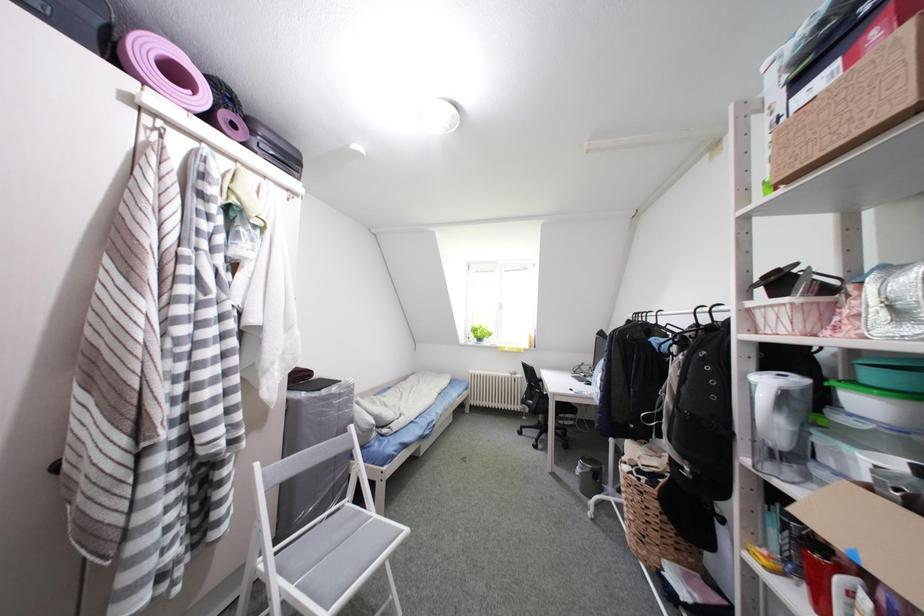
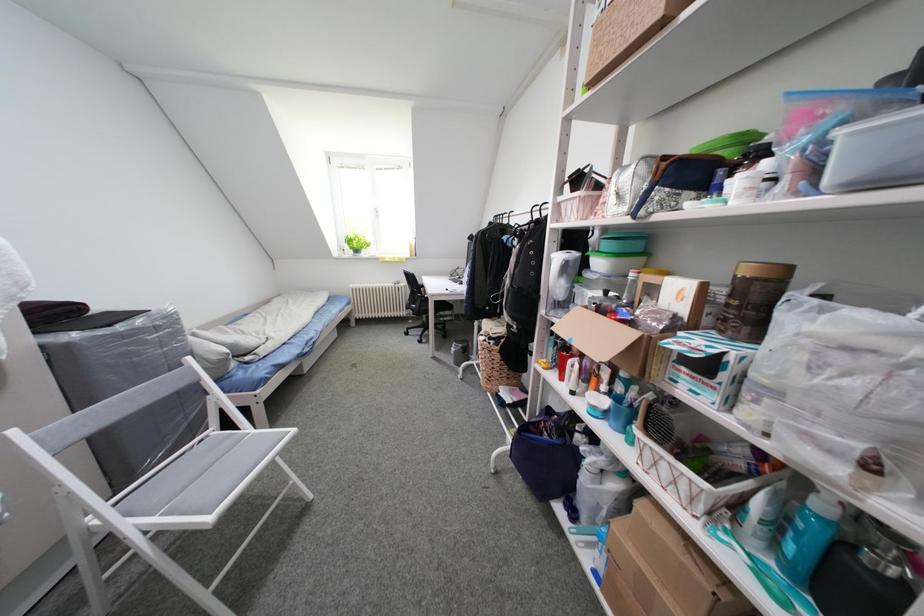
The first image is from the beginning of the video and the second image is from the end. How did the camera likely rotate when shooting the video?

The rotation direction of the camera is right-down.